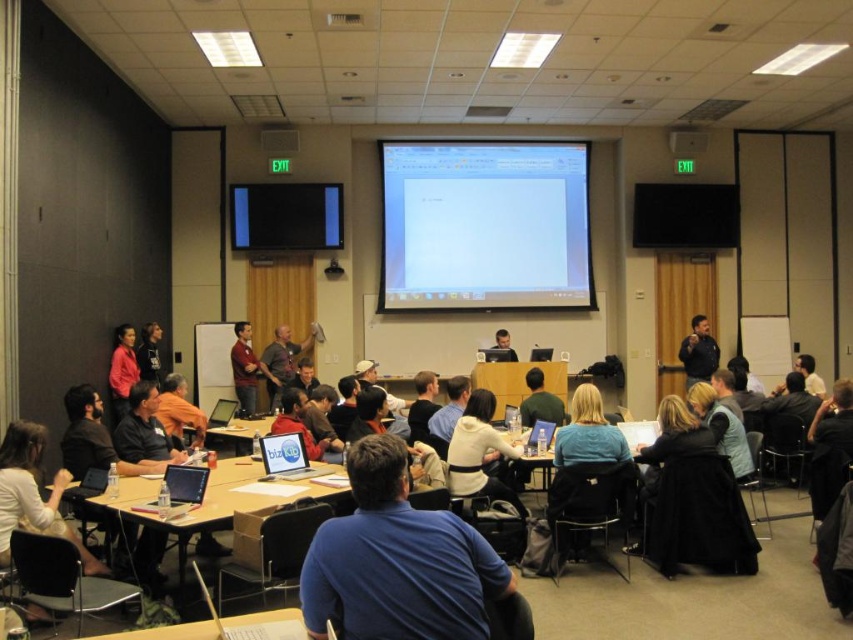
Who is positioned more to the right, white sweater at center or matte black jacket at center?

matte black jacket at center

Who is more distant from viewer, (473, 476) or (692, 330)?

The point (692, 330) is more distant.

The width and height of the screenshot is (853, 640). I want to click on white sweater at center, so click(479, 451).

Is wooden at center to the left of wooden table at center from the viewer's perspective?

No, wooden at center is not to the left of wooden table at center.

Is wooden at center bigger than wooden table at center?

Indeed, wooden at center has a larger size compared to wooden table at center.

Between point (479, 371) and point (264, 426), which one is positioned in front?

Point (264, 426)

I want to click on wooden at center, so click(x=517, y=381).

Can you confirm if matte plastic table at center is taller than wooden at center?

Indeed, matte plastic table at center has a greater height compared to wooden at center.

Between matte plastic table at center and wooden at center, which one has more height?

matte plastic table at center

Measure the distance between point (206, 509) and camera.

Point (206, 509) is 12.43 feet from camera.

Identify the location of matte plastic table at center. (218, 500).